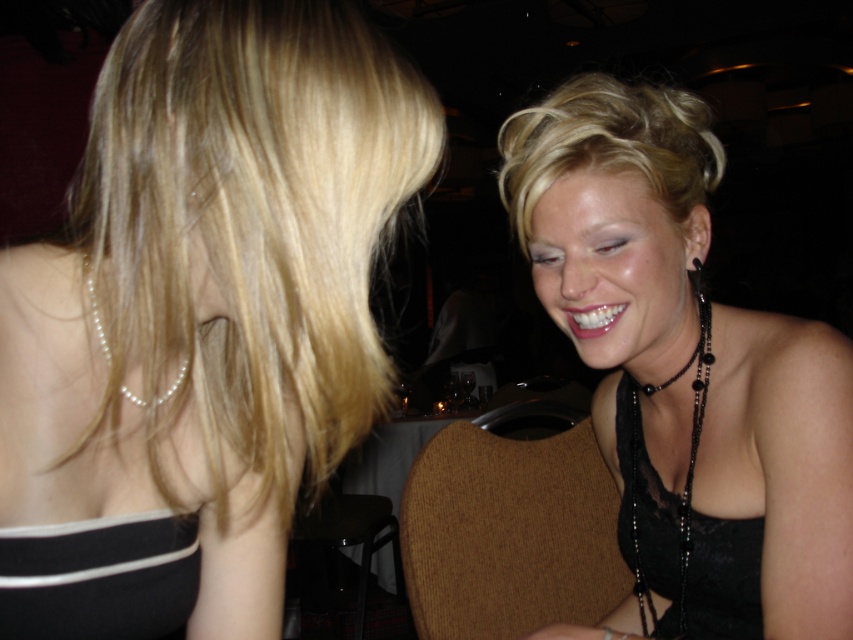
Does wooden table at center lie behind pearl necklace at left?

Yes, wooden table at center is further from the viewer.

Is point (405, 472) closer to viewer compared to point (167, 396)?

That is False.

Is point (350, 480) positioned after point (86, 273)?

Yes, point (350, 480) is behind point (86, 273).

This screenshot has width=853, height=640. I want to click on wooden table at center, so click(x=390, y=456).

This screenshot has height=640, width=853. What do you see at coordinates (647, 513) in the screenshot?
I see `black lace dress at right` at bounding box center [647, 513].

Is point (695, 593) closer to camera compared to point (689, 356)?

No.

Image resolution: width=853 pixels, height=640 pixels. What are the coordinates of `black lace dress at right` in the screenshot? It's located at (647, 513).

Is black satin dress at lower left shorter than pearl necklace at left?

In fact, black satin dress at lower left may be taller than pearl necklace at left.

This screenshot has width=853, height=640. What do you see at coordinates (99, 579) in the screenshot? I see `black satin dress at lower left` at bounding box center [99, 579].

Who is more distant from viewer, (25, 556) or (186, 358)?

The point (25, 556) is behind.

Locate an element on the screen. black satin dress at lower left is located at coordinates (99, 579).